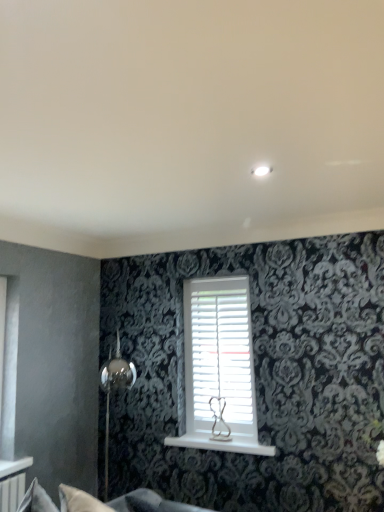
Question: Is white matte shutter at center facing towards soft gray fabric couch at lower left?

Choices:
 (A) no
 (B) yes

Answer: (B)

Question: From the image's perspective, does white matte shutter at center appear lower than soft gray fabric couch at lower left?

Choices:
 (A) yes
 (B) no

Answer: (B)

Question: Is white matte shutter at center next to soft gray fabric couch at lower left and touching it?

Choices:
 (A) yes
 (B) no

Answer: (B)

Question: Can you confirm if white matte shutter at center is taller than soft gray fabric couch at lower left?

Choices:
 (A) no
 (B) yes

Answer: (B)

Question: Is white matte shutter at center closer to the viewer compared to soft gray fabric couch at lower left?

Choices:
 (A) no
 (B) yes

Answer: (A)

Question: Is white glossy window sill at center to the left or to the right of soft gray fabric couch at lower left in the image?

Choices:
 (A) left
 (B) right

Answer: (B)

Question: Is white glossy window sill at center taller or shorter than soft gray fabric couch at lower left?

Choices:
 (A) tall
 (B) short

Answer: (B)

Question: From a real-world perspective, is white glossy window sill at center positioned above or below soft gray fabric couch at lower left?

Choices:
 (A) below
 (B) above

Answer: (B)

Question: Relative to soft gray fabric couch at lower left, is white glossy window sill at center in front or behind?

Choices:
 (A) front
 (B) behind

Answer: (B)

Question: In the image, is soft gray fabric couch at lower left positioned in front of or behind white matte shutter at center?

Choices:
 (A) front
 (B) behind

Answer: (A)

Question: Is soft gray fabric couch at lower left to the left or to the right of white matte shutter at center in the image?

Choices:
 (A) right
 (B) left

Answer: (B)

Question: Is soft gray fabric couch at lower left inside or outside of white matte shutter at center?

Choices:
 (A) outside
 (B) inside

Answer: (A)

Question: From the image's perspective, relative to white matte shutter at center, is soft gray fabric couch at lower left above or below?

Choices:
 (A) above
 (B) below

Answer: (B)

Question: From a real-world perspective, is white matte shutter at center physically located above or below white glossy window sill at center?

Choices:
 (A) above
 (B) below

Answer: (A)

Question: Considering the positions of white matte shutter at center and white glossy window sill at center in the image, is white matte shutter at center wider or thinner than white glossy window sill at center?

Choices:
 (A) wide
 (B) thin

Answer: (B)